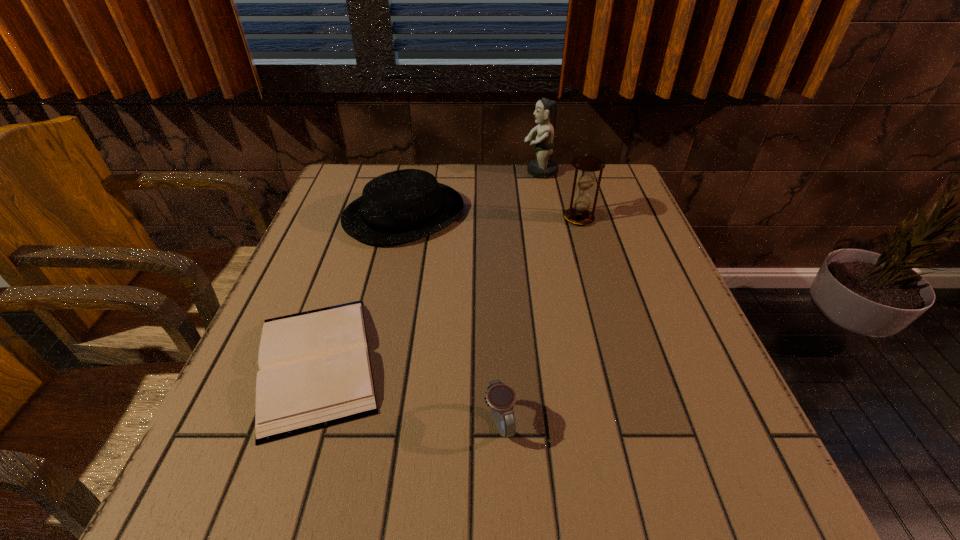
The height and width of the screenshot is (540, 960). Identify the location of vacant space that is in between the second tallest object and the fourth tallest object. (539, 321).

Where is `vacant space that is in between the fourth shortest object and the figurine`? This screenshot has width=960, height=540. vacant space that is in between the fourth shortest object and the figurine is located at coordinates (559, 195).

The image size is (960, 540). In order to click on empty space that is in between the hardback book and the third object from right to left in this screenshot , I will do `click(408, 393)`.

Where is `free space between the farthest object and the shortest object`? The height and width of the screenshot is (540, 960). free space between the farthest object and the shortest object is located at coordinates (428, 267).

Where is `unoccupied position between the hourglass and the farthest object`? This screenshot has width=960, height=540. unoccupied position between the hourglass and the farthest object is located at coordinates (559, 195).

What are the coordinates of `free spot between the hourglass and the fedora` in the screenshot? It's located at (492, 216).

Identify the location of object that is the second closest to the watch. (405, 205).

Identify which object is the fourth nearest to the second tallest object. Please provide its 2D coordinates. Your answer should be formatted as a tuple, i.e. [(x, y)], where the tuple contains the x and y coordinates of a point satisfying the conditions above.

[(501, 398)]

Where is `vacant space that satisfies the following two spatial constraints: 1. on the front-facing side of the figurine; 2. on the front side of the watch`? The height and width of the screenshot is (540, 960). vacant space that satisfies the following two spatial constraints: 1. on the front-facing side of the figurine; 2. on the front side of the watch is located at coordinates (591, 423).

At what (x,y) coordinates should I click in order to perform the action: click on vacant region that satisfies the following two spatial constraints: 1. on the front-facing side of the tallest object; 2. on the front side of the shortest object. Please return your answer as a coordinate pair (x, y). This screenshot has height=540, width=960. Looking at the image, I should click on (579, 363).